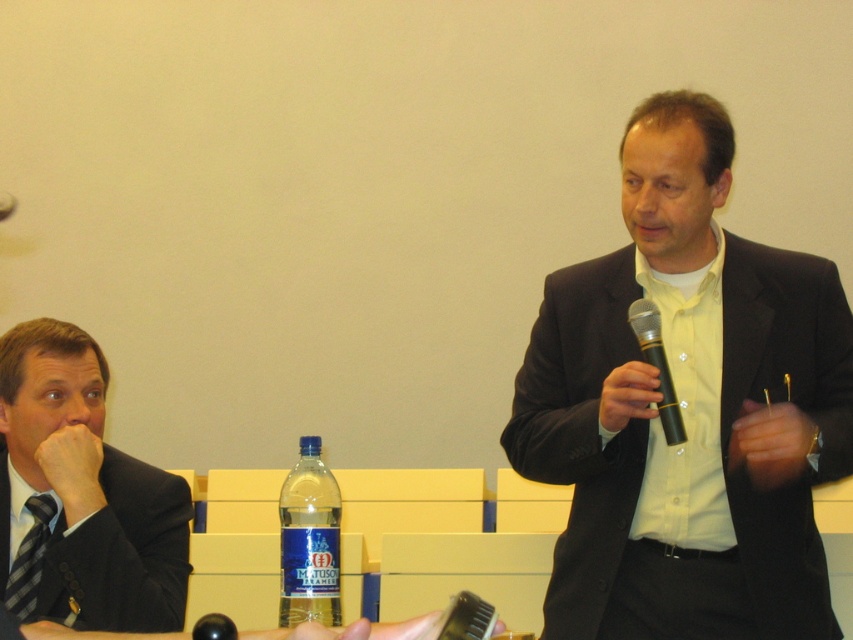
Question: Does matte black suit at right appear over black matte microphone at center?

Choices:
 (A) yes
 (B) no

Answer: (A)

Question: Which is farther from the black textured suit at left?

Choices:
 (A) blue plastic bottle at center
 (B) matte black suit at right
 (C) black matte microphone at center

Answer: (C)

Question: Is matte black suit at right thinner than black matte microphone at center?

Choices:
 (A) no
 (B) yes

Answer: (A)

Question: Which object is positioned farthest from the blue plastic bottle at center?

Choices:
 (A) black textured suit at left
 (B) black matte microphone at center

Answer: (B)

Question: Considering the real-world distances, which object is farthest from the black textured suit at left?

Choices:
 (A) matte black suit at right
 (B) blue plastic bottle at center
 (C) black matte microphone at center

Answer: (C)

Question: From the image, what is the correct spatial relationship of matte black suit at right in relation to black matte microphone at center?

Choices:
 (A) above
 (B) below

Answer: (A)